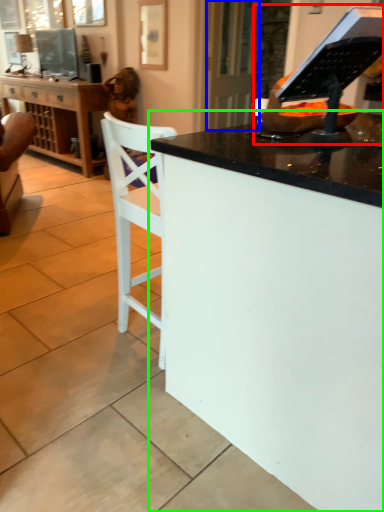
Question: Which is farther away from appliance (highlighted by a red box)? glass door (highlighted by a blue box) or desk (highlighted by a green box)?

Choices:
 (A) glass door
 (B) desk

Answer: (A)